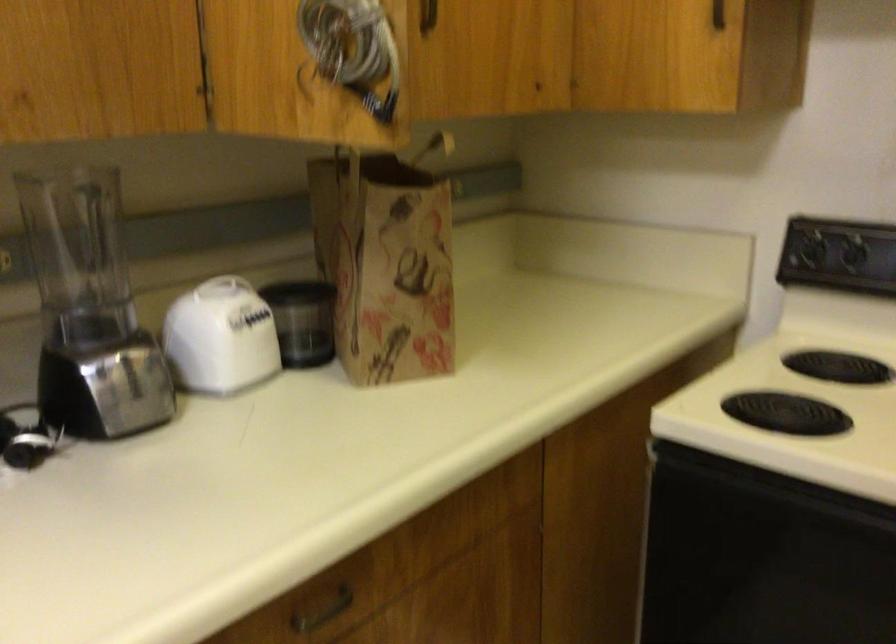
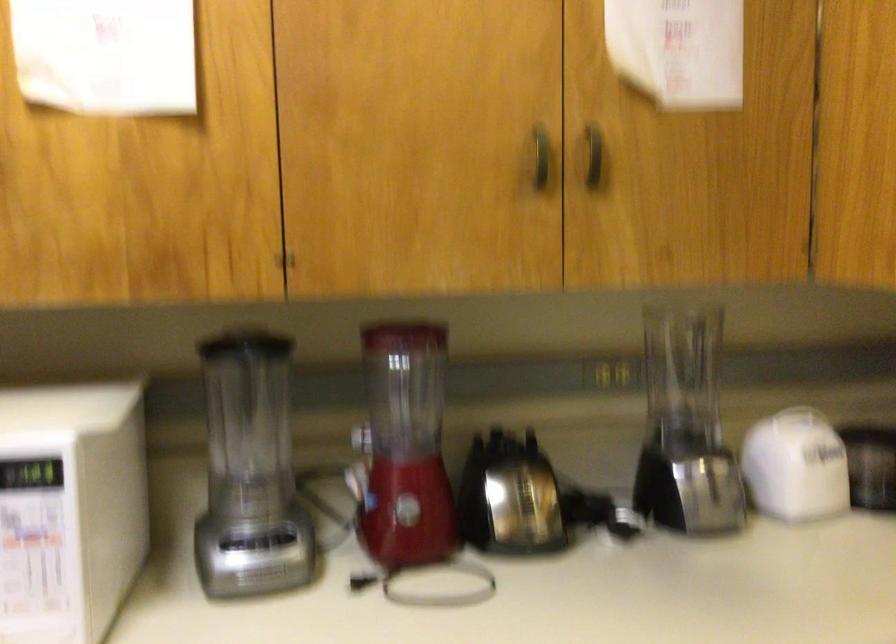
Question: How did the camera likely rotate?

Choices:
 (A) Left
 (B) Right
 (C) Up
 (D) Down

Answer: (A)